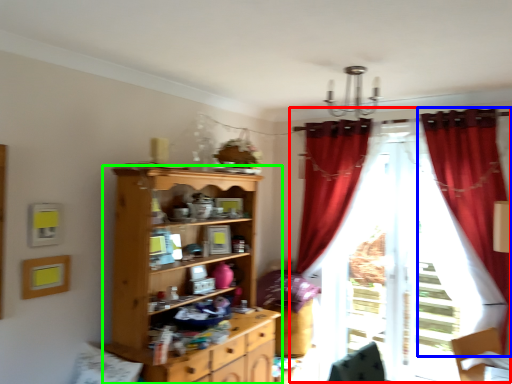
Question: Based on their relative distances, which object is farther from curtain (highlighted by a red box)? Choose from curtain (highlighted by a blue box) and cupboard (highlighted by a green box).

Choices:
 (A) curtain
 (B) cupboard

Answer: (B)